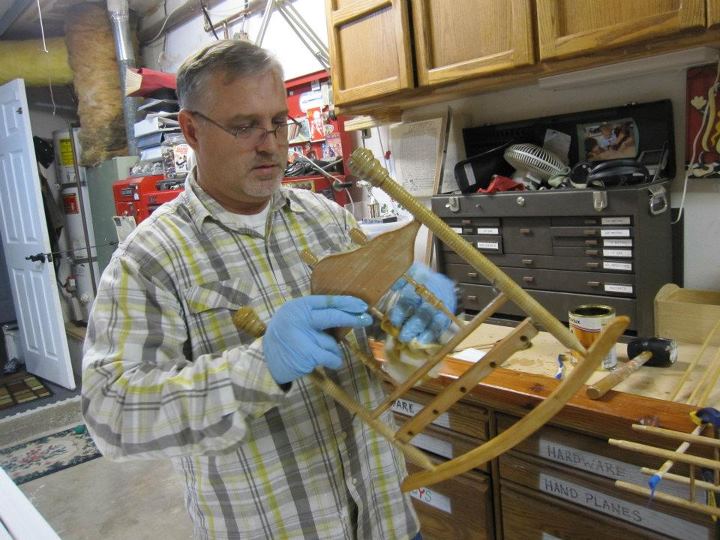
The image size is (720, 540). I want to click on shelve, so click(x=535, y=213).